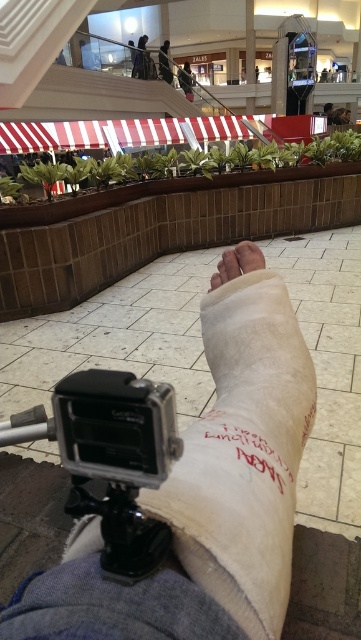
Is silver metallic action camera at lower center thinner than white bandage at center?

No, silver metallic action camera at lower center is not thinner than white bandage at center.

Who is more forward, [97,476] or [223,275]?

Point [97,476]

Between point (140, 528) and point (258, 259), which one is positioned in front?

Point (140, 528)

Identify the location of silver metallic action camera at lower center. The height and width of the screenshot is (640, 361). (110, 458).

Describe the element at coordinates (237, 262) in the screenshot. I see `white bandage at center` at that location.

Looking at this image, is white bandage at center in front of leather jacket at upper center?

Yes, it is in front of leather jacket at upper center.

Is point (212, 284) more distant than point (189, 80)?

No, (212, 284) is closer to viewer.

Locate an element on the screen. white bandage at center is located at coordinates (237, 262).

Is point (166, 44) positioned after point (180, 77)?

Yes.

Is dark clothing figure at upper center taller than leather jacket at upper center?

In fact, dark clothing figure at upper center may be shorter than leather jacket at upper center.

This screenshot has width=361, height=640. Find the location of `dark clothing figure at upper center`. dark clothing figure at upper center is located at coordinates (164, 61).